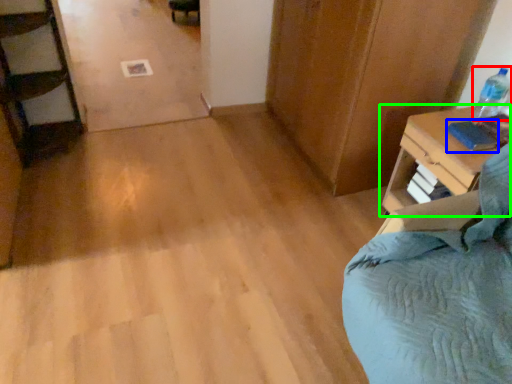
Question: Which object is the closest to the bottle (highlighted by a red box)? Choose among these: book (highlighted by a blue box) or nightstand (highlighted by a green box).

Choices:
 (A) book
 (B) nightstand

Answer: (A)